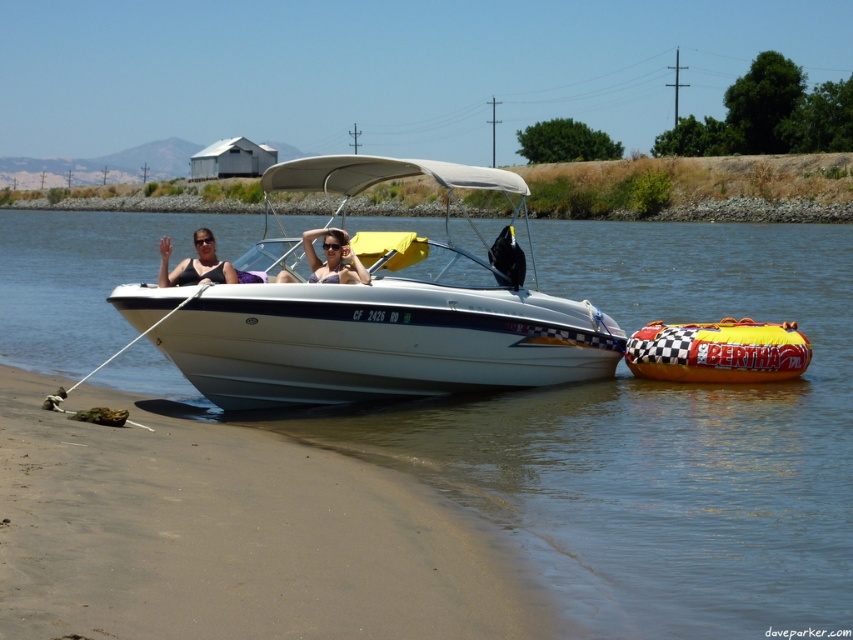
This screenshot has width=853, height=640. What do you see at coordinates (230, 534) in the screenshot?
I see `sandy brown at lower left` at bounding box center [230, 534].

Is point (508, 577) behind point (672, 355)?

No, it is in front of (672, 355).

Where is `sandy brown at lower left`? The image size is (853, 640). sandy brown at lower left is located at coordinates (230, 534).

The height and width of the screenshot is (640, 853). What are the coordinates of `white glossy water at center` in the screenshot? It's located at (646, 438).

Which is more to the left, white glossy water at center or sandy brown at lower left?

white glossy water at center

Locate an element on the screen. white glossy water at center is located at coordinates (646, 438).

Is point (838, 352) less distant than point (392, 390)?

That is False.

Between white glossy water at center and white glossy boat at center, which one has more height?

With more height is white glossy boat at center.

Find the location of `white glossy water at center`. white glossy water at center is located at coordinates tap(646, 438).

This screenshot has height=640, width=853. Find the location of `white glossy water at center`. white glossy water at center is located at coordinates (646, 438).